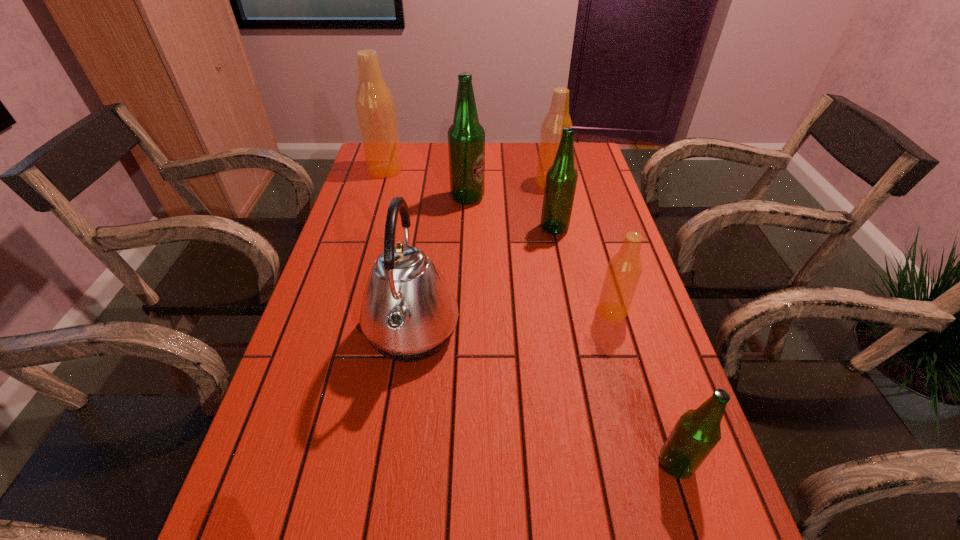
Locate an element on the screen. The width and height of the screenshot is (960, 540). vacant region located on the label of the smallest green beer bottle is located at coordinates (471, 464).

Find the location of a particular element. vacant position located 0.180m on the label of the smallest green beer bottle is located at coordinates (556, 464).

Where is `vacant position located on the left of the second nearest beer bottle`? vacant position located on the left of the second nearest beer bottle is located at coordinates (524, 312).

This screenshot has width=960, height=540. I want to click on beer bottle situated at the left edge, so click(x=374, y=103).

Find the location of a particular element. The image size is (960, 540). kettle that is at the left edge is located at coordinates point(408,313).

This screenshot has width=960, height=540. Identify the location of object present at the far left corner. (374, 103).

Where is `object at the far right corner`? This screenshot has width=960, height=540. object at the far right corner is located at coordinates (558, 117).

Where is `vacant position at the far edge of the desktop`? This screenshot has width=960, height=540. vacant position at the far edge of the desktop is located at coordinates (418, 151).

In the image, there is a desktop. Where is `vacant space at the left edge`? vacant space at the left edge is located at coordinates click(x=323, y=310).

The image size is (960, 540). What are the coordinates of `free space at the right edge of the desktop` in the screenshot? It's located at (593, 204).